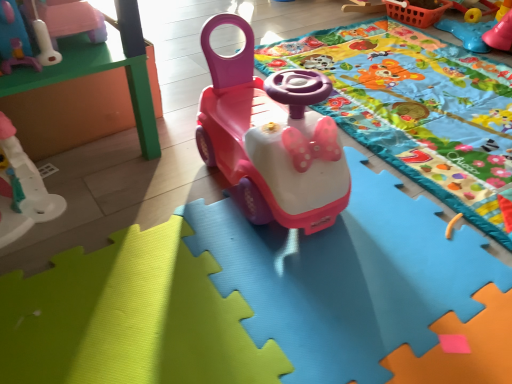
Question: Is matte plastic car at center, placed as the 3th toy when sorted from left to right, at the back of rubberized blue steering wheel at upper right, the first toy viewed from the right?

Choices:
 (A) yes
 (B) no

Answer: (B)

Question: From a real-world perspective, does rubberized blue steering wheel at upper right, the first toy viewed from the right, stand above matte plastic car at center, placed as the 3th toy when sorted from left to right?

Choices:
 (A) no
 (B) yes

Answer: (A)

Question: Can you confirm if rubberized blue steering wheel at upper right, the first toy viewed from the right, is shorter than matte plastic car at center, placed as the 3th toy when sorted from left to right?

Choices:
 (A) no
 (B) yes

Answer: (B)

Question: Is rubberized blue steering wheel at upper right, positioned as the fourth toy in left-to-right order, bigger than matte plastic car at center, the second toy viewed from the right?

Choices:
 (A) no
 (B) yes

Answer: (A)

Question: Is rubberized blue steering wheel at upper right, positioned as the fourth toy in left-to-right order, not inside matte plastic car at center, placed as the 3th toy when sorted from left to right?

Choices:
 (A) yes
 (B) no

Answer: (A)

Question: From a real-world perspective, is matte plastic car at center, the second toy viewed from the right, physically located above or below rubberized blue steering wheel at upper right, positioned as the fourth toy in left-to-right order?

Choices:
 (A) above
 (B) below

Answer: (A)

Question: Considering the positions of point (331, 125) and point (475, 33), is point (331, 125) closer or farther from the camera than point (475, 33)?

Choices:
 (A) farther
 (B) closer

Answer: (B)

Question: Is matte plastic car at center, the second toy viewed from the right, taller or shorter than rubberized blue steering wheel at upper right, the first toy viewed from the right?

Choices:
 (A) short
 (B) tall

Answer: (B)

Question: From the image's perspective, is matte plastic car at center, the second toy viewed from the right, above or below rubberized blue steering wheel at upper right, positioned as the fourth toy in left-to-right order?

Choices:
 (A) below
 (B) above

Answer: (A)

Question: From a real-world perspective, is white plastic toy at left, which is the 1th toy from left to right, physically located above or below matte plastic blanket at center?

Choices:
 (A) below
 (B) above

Answer: (B)

Question: From their relative heights in the image, would you say white plastic toy at left, which is the 1th toy from left to right, is taller or shorter than matte plastic blanket at center?

Choices:
 (A) tall
 (B) short

Answer: (A)

Question: Considering the positions of point (33, 193) and point (396, 77), is point (33, 193) closer or farther from the camera than point (396, 77)?

Choices:
 (A) closer
 (B) farther

Answer: (A)

Question: Is white plastic toy at left, which is the 1th toy from left to right, situated inside matte plastic blanket at center or outside?

Choices:
 (A) inside
 (B) outside

Answer: (B)

Question: Considering the positions of rubberized blue steering wheel at upper right, positioned as the fourth toy in left-to-right order, and matte pink toy at upper left, which is the third toy from right to left, in the image, is rubberized blue steering wheel at upper right, positioned as the fourth toy in left-to-right order, bigger or smaller than matte pink toy at upper left, which is the third toy from right to left,?

Choices:
 (A) small
 (B) big

Answer: (B)

Question: Which is correct: rubberized blue steering wheel at upper right, positioned as the fourth toy in left-to-right order, is inside matte pink toy at upper left, which is the third toy from right to left, or outside of it?

Choices:
 (A) inside
 (B) outside

Answer: (B)